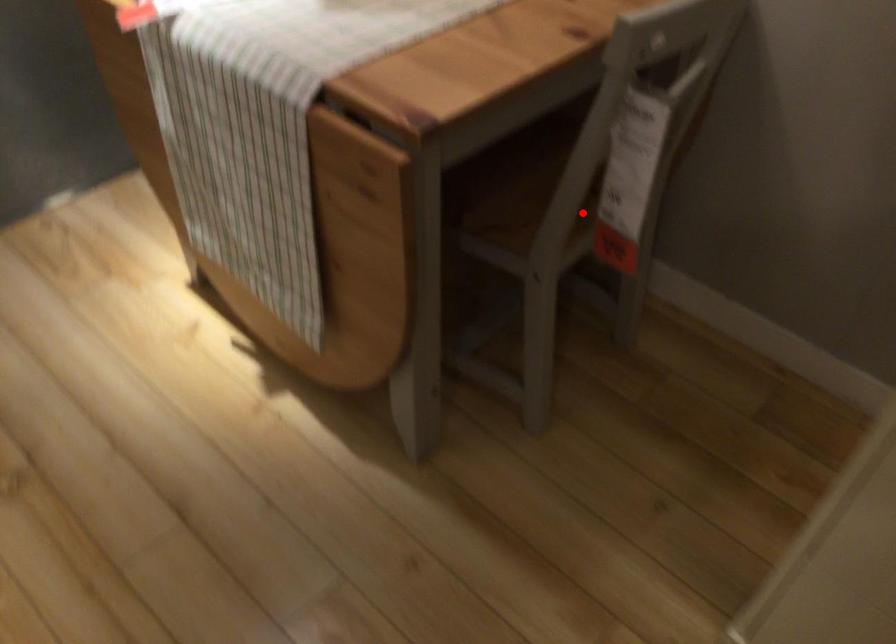
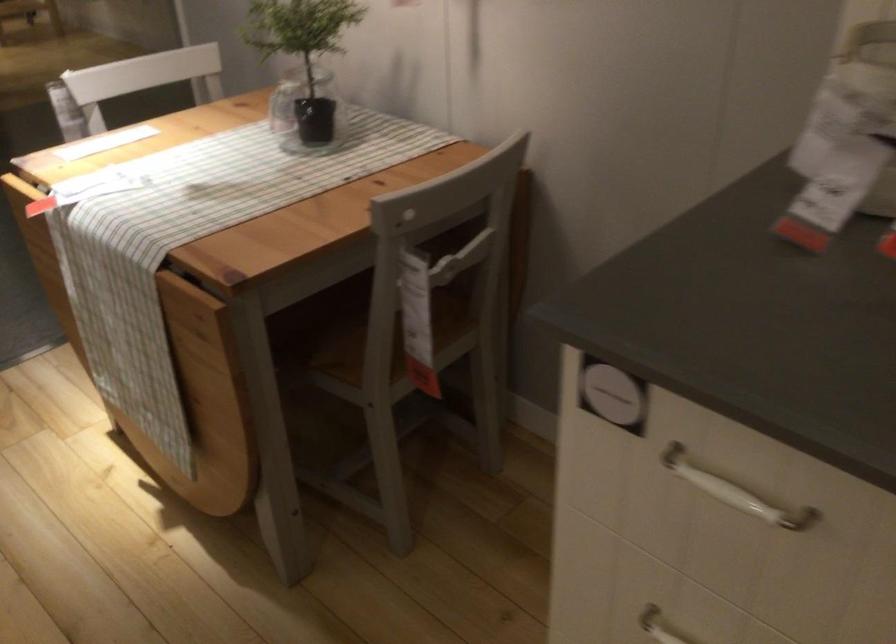
In the second image, find the point that corresponds to the highlighted location in the first image.

(390, 350)